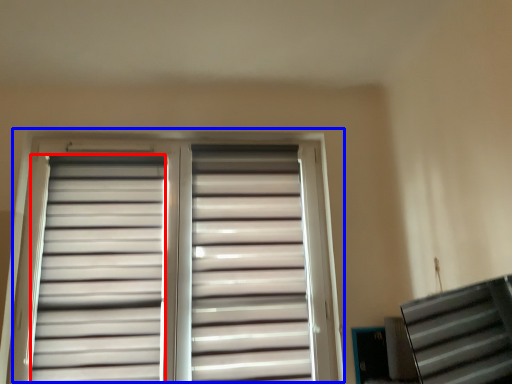
Question: Which of the following is the farthest to the observer, shutter (highlighted by a red box) or window (highlighted by a blue box)?

Choices:
 (A) shutter
 (B) window

Answer: (B)